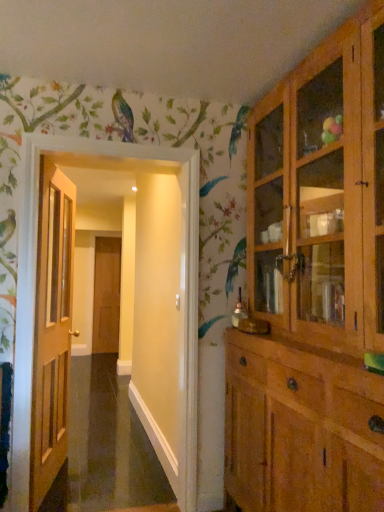
Question: Based on their sizes in the image, would you say light brown wood cabinet at right is bigger or smaller than brown wooden door at center, marked as the second door in a right-to-left arrangement?

Choices:
 (A) small
 (B) big

Answer: (B)

Question: From the image's perspective, is light brown wood cabinet at right positioned above or below brown wooden door at center, the 1th door from the back?

Choices:
 (A) below
 (B) above

Answer: (B)

Question: Which object is the closest to the wooden door at left?

Choices:
 (A) wooden door at left, which is the 2th door from left to right
 (B) brown wooden door at center, marked as the second door in a right-to-left arrangement
 (C) light brown wood cabinet at right

Answer: (A)

Question: Estimate the real-world distances between objects in this image. Which object is farther from the light brown wood cabinet at right?

Choices:
 (A) wooden door at left
 (B) brown wooden door at center, placed as the 2th door when sorted from front to back
 (C) wooden door at left, which is the 2th door from left to right

Answer: (B)